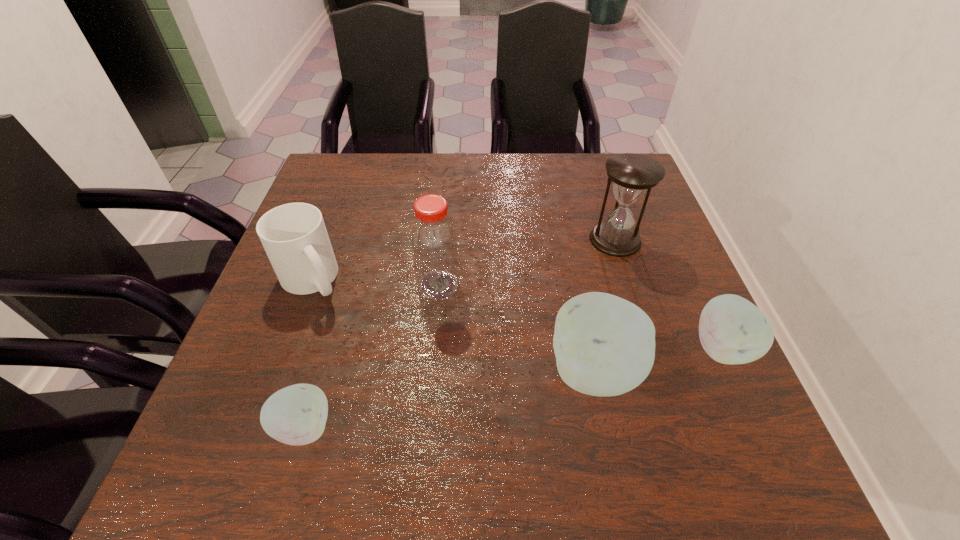
Image resolution: width=960 pixels, height=540 pixels. In order to click on vacant region located on the front of the rightmost apple in this screenshot , I will do `click(743, 399)`.

You are a GUI agent. You are given a task and a screenshot of the screen. Output one action in this format:
    pyautogui.click(x=<x>, y=<y>)
    Task: Click on the vacant space located on the right of the mug
    
    Given the screenshot: What is the action you would take?
    pyautogui.click(x=519, y=280)

The image size is (960, 540). In order to click on blank space located on the front of the hourglass in this screenshot , I will do `click(649, 344)`.

The image size is (960, 540). In order to click on blank space located 0.260m on the left of the bottle in this screenshot , I will do pos(300,286).

At what (x,y) coordinates should I click in order to perform the action: click on apple at the left edge. Please return your answer as a coordinate pair (x, y). Looking at the image, I should click on (296, 415).

Where is `mug that is at the left edge`? The image size is (960, 540). mug that is at the left edge is located at coordinates (294, 236).

Locate an element on the screen. The width and height of the screenshot is (960, 540). apple positioned at the right edge is located at coordinates (732, 330).

The width and height of the screenshot is (960, 540). What are the coordinates of `hourglass that is at the right edge` in the screenshot? It's located at (633, 175).

Locate an element on the screen. The width and height of the screenshot is (960, 540). object that is positioned at the near left corner is located at coordinates (296, 415).

Identify the location of free region at the far edge. (425, 165).